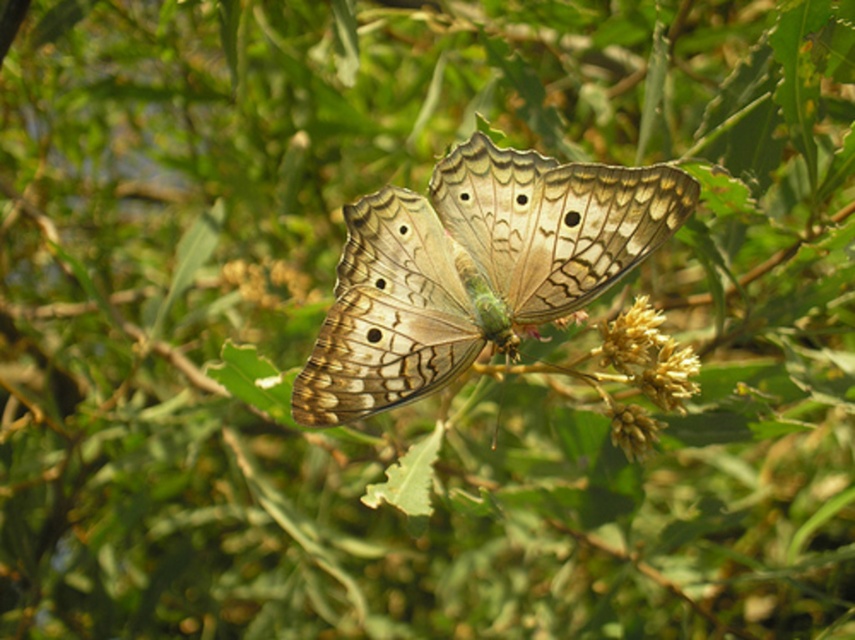
Which is below, brown textured butterfly at center or yellowish-green textured flower at center-right?

Positioned lower is yellowish-green textured flower at center-right.

What do you see at coordinates (475, 268) in the screenshot? The height and width of the screenshot is (640, 855). I see `brown textured butterfly at center` at bounding box center [475, 268].

The height and width of the screenshot is (640, 855). Find the location of `brown textured butterfly at center`. brown textured butterfly at center is located at coordinates (475, 268).